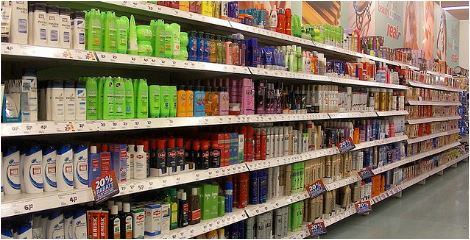
Where is `2 middle shelves`? 2 middle shelves is located at coordinates (304, 116), (312, 150).